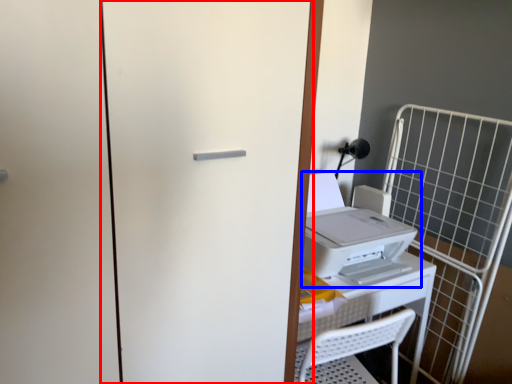
Question: Which of the following is the farthest to the observer, screen door (highlighted by a red box) or home appliance (highlighted by a blue box)?

Choices:
 (A) screen door
 (B) home appliance

Answer: (B)